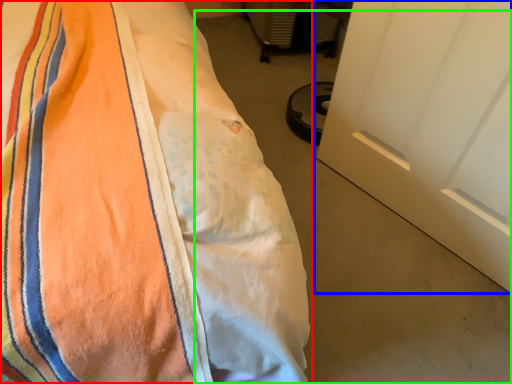
Question: Which is farther away from bed (highlighted by a red box)? door (highlighted by a blue box) or concrete (highlighted by a green box)?

Choices:
 (A) door
 (B) concrete

Answer: (B)